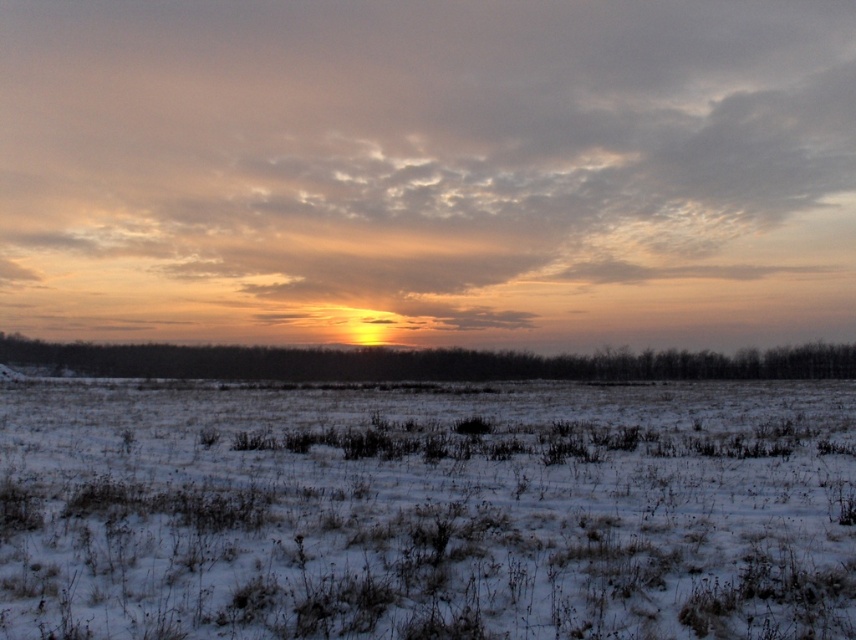
Can you confirm if cloudy sky at center is taller than white snow-covered grassland at center?

Correct, cloudy sky at center is much taller as white snow-covered grassland at center.

Who is shorter, cloudy sky at center or white snow-covered grassland at center?

white snow-covered grassland at center

Between point (776, 48) and point (88, 452), which one is positioned in front?

Point (88, 452) is in front.

I want to click on cloudy sky at center, so click(428, 172).